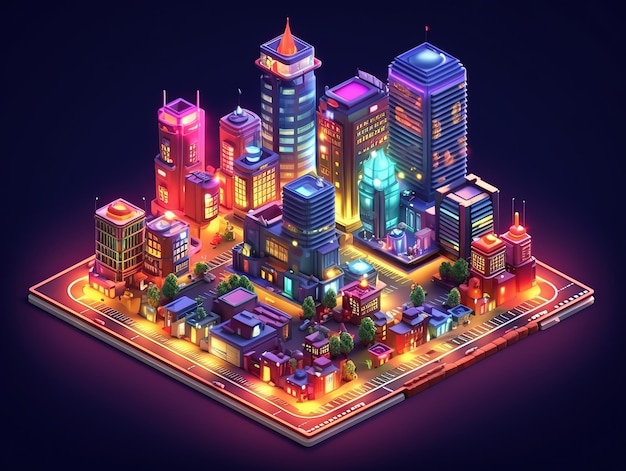
At what (x,y) coordinates should I click in order to perform the action: click on floors. Please return your answer as a coordinate pair (x, y). This screenshot has width=626, height=471. Looking at the image, I should click on tap(444, 169), tap(453, 158), tap(444, 139), tap(444, 124), tap(444, 111).